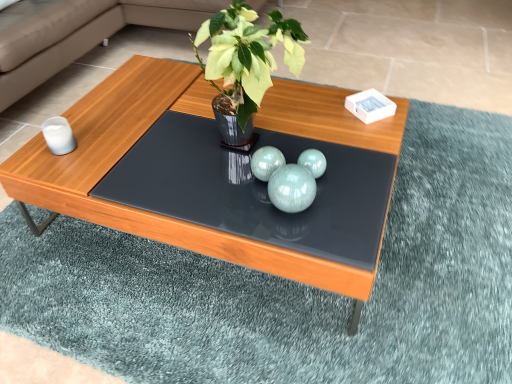
You are a GUI agent. You are given a task and a screenshot of the screen. Output one action in this format:
    pyautogui.click(x=<x>, y=<y>)
    Task: Click on the vacant area that is in front of teal glossy spheres at center
    
    Given the screenshot: What is the action you would take?
    pyautogui.click(x=304, y=238)